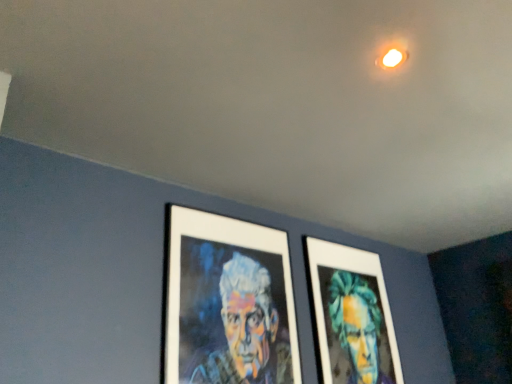
Question: Is multicolored canvas portrait at center, which is the first person from left to right, taller than matte green portrait at center, the 1th person in the right-to-left sequence?

Choices:
 (A) yes
 (B) no

Answer: (B)

Question: Can you confirm if multicolored canvas portrait at center, the second person from the right, is bigger than matte green portrait at center, the 1th person in the right-to-left sequence?

Choices:
 (A) yes
 (B) no

Answer: (B)

Question: Is multicolored canvas portrait at center, which is the first person from left to right, smaller than matte green portrait at center, the 1th person in the right-to-left sequence?

Choices:
 (A) yes
 (B) no

Answer: (A)

Question: Is multicolored canvas portrait at center, which is the first person from left to right, shorter than matte green portrait at center, the 1th person in the right-to-left sequence?

Choices:
 (A) no
 (B) yes

Answer: (B)

Question: Considering the relative positions of multicolored canvas portrait at center, the second person from the right, and matte green portrait at center, the second person from the left, in the image provided, is multicolored canvas portrait at center, the second person from the right, behind matte green portrait at center, the second person from the left,?

Choices:
 (A) no
 (B) yes

Answer: (A)

Question: Is multicolored canvas portrait at center, the second person from the right, to the right of matte green portrait at center, the second person from the left, from the viewer's perspective?

Choices:
 (A) yes
 (B) no

Answer: (B)

Question: From a real-world perspective, is matte green portrait at center, the 1th person in the right-to-left sequence, positioned under multicolored canvas portrait at center, which is the first person from left to right, based on gravity?

Choices:
 (A) no
 (B) yes

Answer: (B)

Question: Considering the relative sizes of matte green portrait at center, the second person from the left, and multicolored canvas portrait at center, which is the first person from left to right, in the image provided, is matte green portrait at center, the second person from the left, smaller than multicolored canvas portrait at center, which is the first person from left to right,?

Choices:
 (A) yes
 (B) no

Answer: (B)

Question: Is matte green portrait at center, the second person from the left, placed right next to multicolored canvas portrait at center, which is the first person from left to right?

Choices:
 (A) no
 (B) yes

Answer: (A)

Question: From the image's perspective, is matte green portrait at center, the second person from the left, below multicolored canvas portrait at center, the second person from the right?

Choices:
 (A) no
 (B) yes

Answer: (B)

Question: From the image's perspective, is matte green portrait at center, the second person from the left, over multicolored canvas portrait at center, which is the first person from left to right?

Choices:
 (A) yes
 (B) no

Answer: (B)

Question: Is matte green portrait at center, the 1th person in the right-to-left sequence, taller than multicolored canvas portrait at center, the second person from the right?

Choices:
 (A) no
 (B) yes

Answer: (B)

Question: Considering the relative positions of matte green portrait at center, the 1th person in the right-to-left sequence, and multicolored canvas portrait at center, which is the first person from left to right, in the image provided, is matte green portrait at center, the 1th person in the right-to-left sequence, to the left or to the right of multicolored canvas portrait at center, which is the first person from left to right,?

Choices:
 (A) right
 (B) left

Answer: (A)